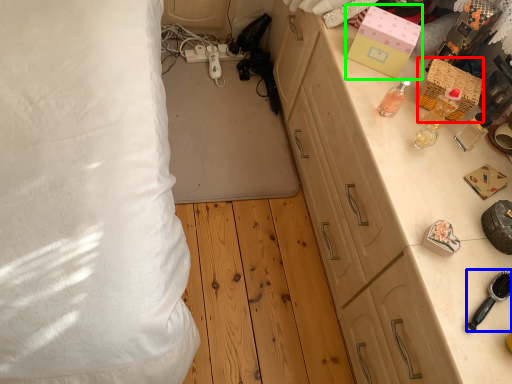
Question: Estimate the real-world distances between objects in this image. Which object is farther from box (highlighted by a red box), brush (highlighted by a blue box) or box (highlighted by a green box)?

Choices:
 (A) brush
 (B) box

Answer: (A)